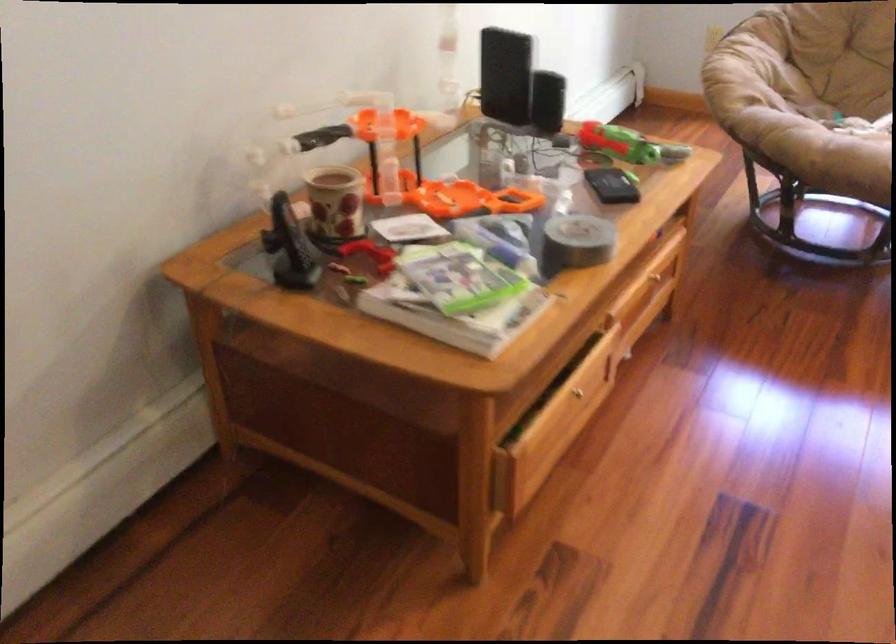
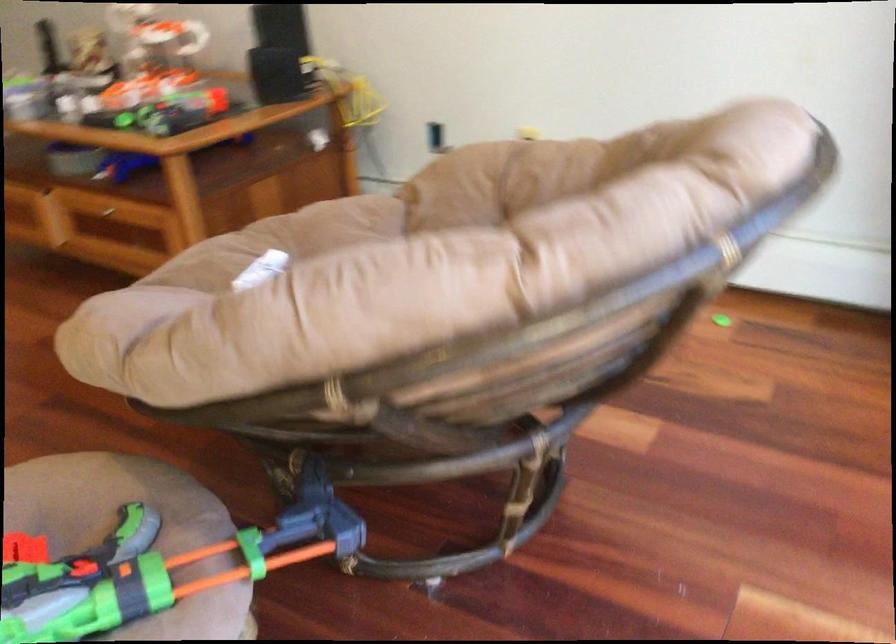
The point at (821, 129) is marked in the first image. Where is the corresponding point in the second image?

(281, 241)